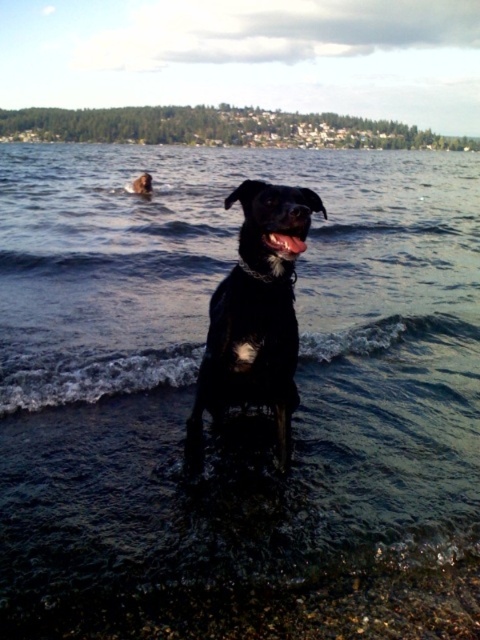
You are a photographer holding a camera. You want to capture a closeup of the smooth pebbles at lower center without getting your camera wet. The water around the black dog is up to your knees. Can you safely take the photo from your current position?

The smooth pebbles at lower center and camera are 1.91 meters apart from each other. Since the water is only up to your knees, you can safely take the photo from your current position as the distance is manageable and the camera won not get wet.

You are standing on the lakeside and want to pick up the smooth pebbles at lower center to give to your friend. However, you need to avoid stepping on the shiny black dog at center. Based on the scene, which direction should you move to reach the pebbles without stepping on the dog?

The smooth pebbles at lower center are on the right side of the shiny black dog at center. To reach them without stepping on the dog, you should move to the right side of the shiny black dog at center.

You are a photographer trying to capture the shiny black dog at center without the smooth pebbles at lower center showing in the photo. Based on their positions, can you adjust your camera angle to achieve this?

The smooth pebbles at lower center are positioned under the shiny black dog at center, so adjusting the camera angle upwards might hide the pebbles by framing the dog against the water background instead.